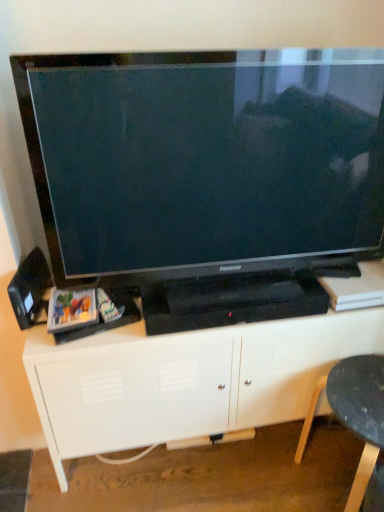
Where is `black plastic speaker at left`? black plastic speaker at left is located at coordinates (30, 290).

What do you see at coordinates (185, 380) in the screenshot? The image size is (384, 512). I see `white matte entertainment center at center` at bounding box center [185, 380].

Find the location of a particular element. black plastic speaker at left is located at coordinates (30, 290).

Would you say black plastic chair at lower right contains black plastic speaker at left?

No.

Image resolution: width=384 pixels, height=512 pixels. In the image, there is a black plastic chair at lower right. Find the location of `speaker above it (from the image's perspective)`. speaker above it (from the image's perspective) is located at coordinates (30, 290).

Considering the sizes of objects black plastic chair at lower right and black plastic speaker at left in the image provided, who is thinner, black plastic chair at lower right or black plastic speaker at left?

black plastic speaker at left.

Which of these two, black plastic chair at lower right or black plastic speaker at left, stands shorter?

black plastic speaker at left.

Between point (31, 288) and point (374, 448), which one is positioned behind?

The point (31, 288) is behind.

Does black plastic speaker at left have a smaller size compared to black plastic chair at lower right?

Indeed, black plastic speaker at left has a smaller size compared to black plastic chair at lower right.

At what (x,y) coordinates should I click in order to perform the action: click on speaker behind the black plastic chair at lower right. Please return your answer as a coordinate pair (x, y). Image resolution: width=384 pixels, height=512 pixels. Looking at the image, I should click on (30, 290).

Is black plastic speaker at left beside black plastic chair at lower right?

No, black plastic speaker at left is not touching black plastic chair at lower right.

Which of these two, black plastic speaker at left or white matte entertainment center at center, is wider?

white matte entertainment center at center.

Is the position of black plastic speaker at left less distant than that of white matte entertainment center at center?

No, it is not.

From the image's perspective, would you say black plastic chair at lower right is positioned over black glossy television at center?

No, from the image's perspective, black plastic chair at lower right is not above black glossy television at center.

Does black plastic chair at lower right contain black glossy television at center?

No, black glossy television at center is located outside of black plastic chair at lower right.

Is there a large distance between black plastic chair at lower right and black glossy television at center?

No, black plastic chair at lower right is not far away from black glossy television at center.

Is black plastic speaker at left next to black glossy television at center?

There is a gap between black plastic speaker at left and black glossy television at center.

From the picture: Which object is closer to the camera taking this photo, black plastic speaker at left or black glossy television at center?

black glossy television at center is in front.

From the image's perspective, which object appears higher, black plastic speaker at left or black glossy television at center?

black glossy television at center.

In the scene shown: Between white matte entertainment center at center and black glossy television at center, which one has less height?

Standing shorter between the two is white matte entertainment center at center.

In terms of size, does white matte entertainment center at center appear bigger or smaller than black glossy television at center?

In the image, white matte entertainment center at center appears to be larger than black glossy television at center.

Image resolution: width=384 pixels, height=512 pixels. Identify the location of television above the white matte entertainment center at center (from a real-world perspective). (206, 178).

Would you say black glossy television at center is a long distance from black plastic speaker at left?

No, there isn't a large distance between black glossy television at center and black plastic speaker at left.

Could black plastic speaker at left be considered to be inside black glossy television at center?

Actually, black plastic speaker at left is outside black glossy television at center.

Consider the image. Can you tell me how much black glossy television at center and black plastic speaker at left differ in facing direction?

They differ by 1.94 degrees in their facing directions.

Who is smaller, black glossy television at center or black plastic speaker at left?

black plastic speaker at left.

You are a GUI agent. You are given a task and a screenshot of the screen. Output one action in this format:
    pyautogui.click(x=<x>, y=<y>)
    Task: Click on the speaker above the black plastic chair at lower right (from a real-world perspective)
    This screenshot has width=384, height=512.
    Given the screenshot: What is the action you would take?
    pyautogui.click(x=30, y=290)

Find the location of a particular element. The width and height of the screenshot is (384, 512). furniture in front of the black plastic speaker at left is located at coordinates (354, 413).

Which object lies nearer to the anchor point black plastic chair at lower right, white matte entertainment center at center or black plastic speaker at left?

The object closer to black plastic chair at lower right is white matte entertainment center at center.

In the scene shown: Which object lies nearer to the anchor point white matte entertainment center at center, black plastic speaker at left or black plastic chair at lower right?

Based on the image, black plastic chair at lower right appears to be nearer to white matte entertainment center at center.

Looking at the image, which one is located further to black plastic speaker at left, black glossy television at center or white matte entertainment center at center?

black glossy television at center.

In the scene shown: When comparing their distances from black plastic speaker at left, does white matte entertainment center at center or black glossy television at center seem closer?

Based on the image, white matte entertainment center at center appears to be nearer to black plastic speaker at left.

When comparing their distances from black plastic speaker at left, does black plastic chair at lower right or black glossy television at center seem further?

black plastic chair at lower right.

From the image, which object appears to be farther from black plastic speaker at left, black plastic chair at lower right or white matte entertainment center at center?

Among the two, black plastic chair at lower right is located further to black plastic speaker at left.

From the image, which object appears to be farther from black plastic chair at lower right, black glossy television at center or white matte entertainment center at center?

black glossy television at center.

From the picture: Which object lies nearer to the anchor point black glossy television at center, black plastic speaker at left or white matte entertainment center at center?

Among the two, white matte entertainment center at center is located nearer to black glossy television at center.

The height and width of the screenshot is (512, 384). I want to click on television between black plastic speaker at left and black plastic chair at lower right from left to right, so click(206, 178).

The image size is (384, 512). I want to click on entertainment center situated between black plastic speaker at left and black glossy television at center from left to right, so click(185, 380).

Locate an element on the screen. The height and width of the screenshot is (512, 384). entertainment center between black glossy television at center and black plastic chair at lower right in the vertical direction is located at coordinates (185, 380).

Identify the location of entertainment center between black plastic speaker at left and black plastic chair at lower right in the horizontal direction. The height and width of the screenshot is (512, 384). (185, 380).